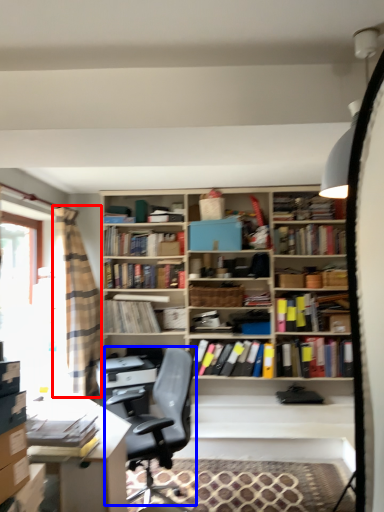
Question: Which point is further to the camera, curtain (highlighted by a red box) or chair (highlighted by a blue box)?

Choices:
 (A) curtain
 (B) chair

Answer: (A)